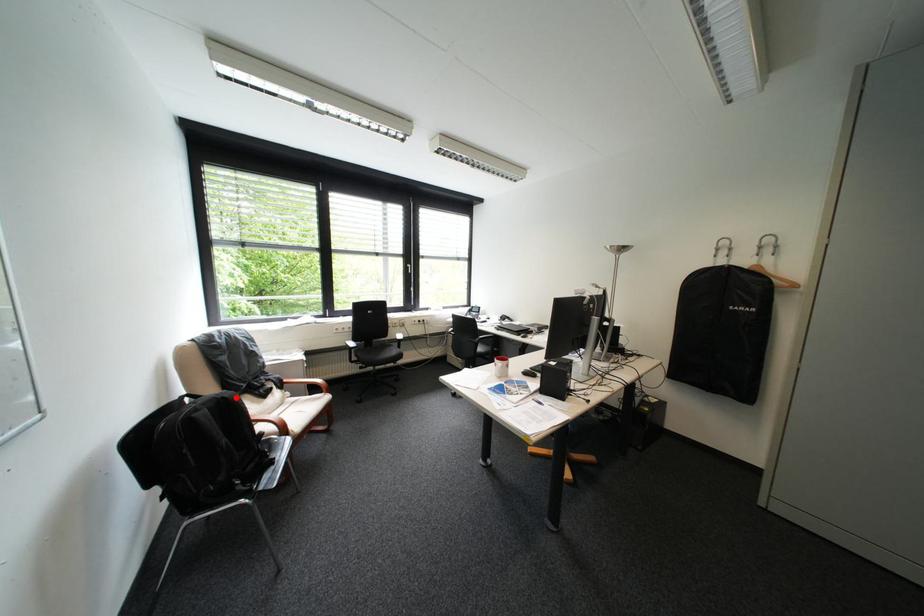
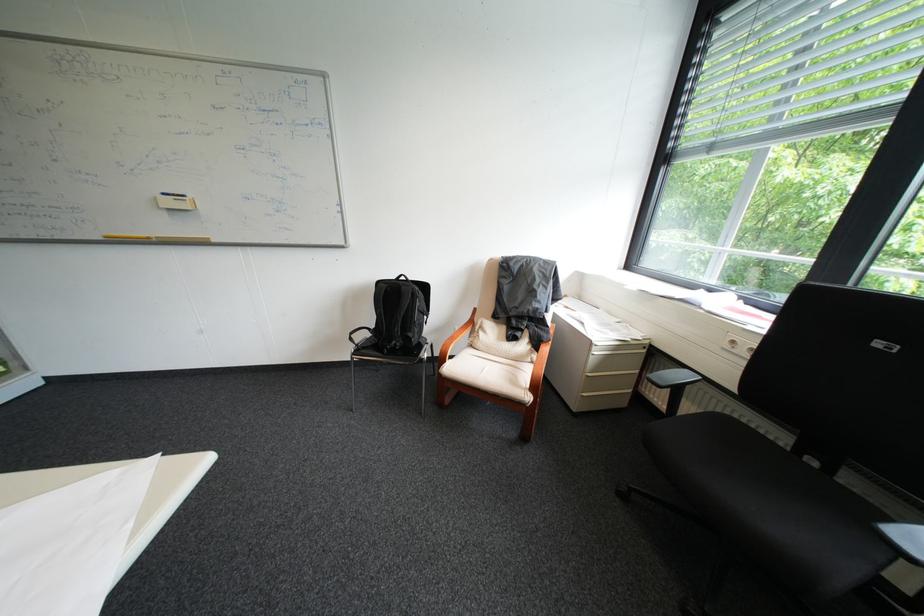
Question: A red point is marked in image1. In image2, is the corresponding 3D point closer to the camera or farther? Reply with the corresponding letter.

Choices:
 (A) The corresponding 3D point is closer.
 (B) The corresponding 3D point is farther.

Answer: (B)